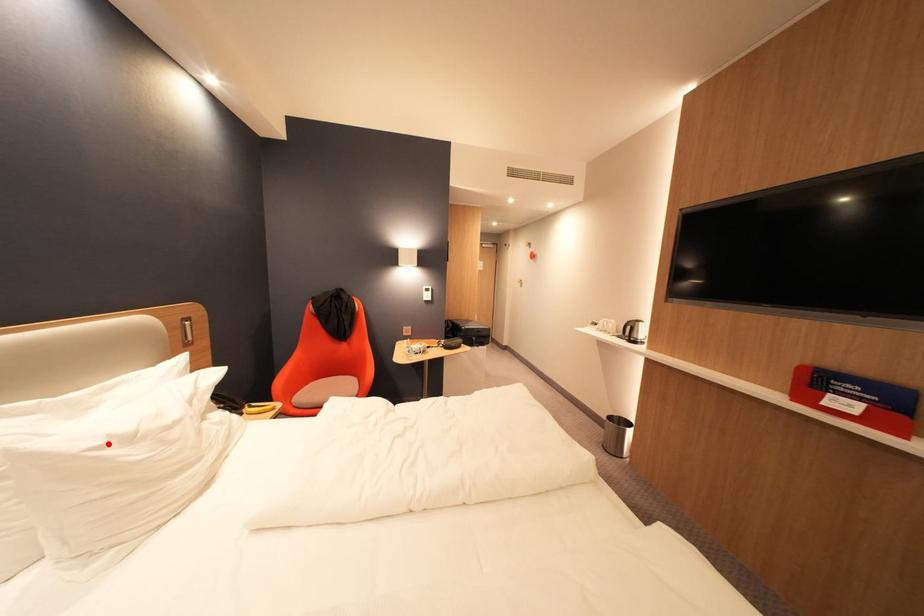
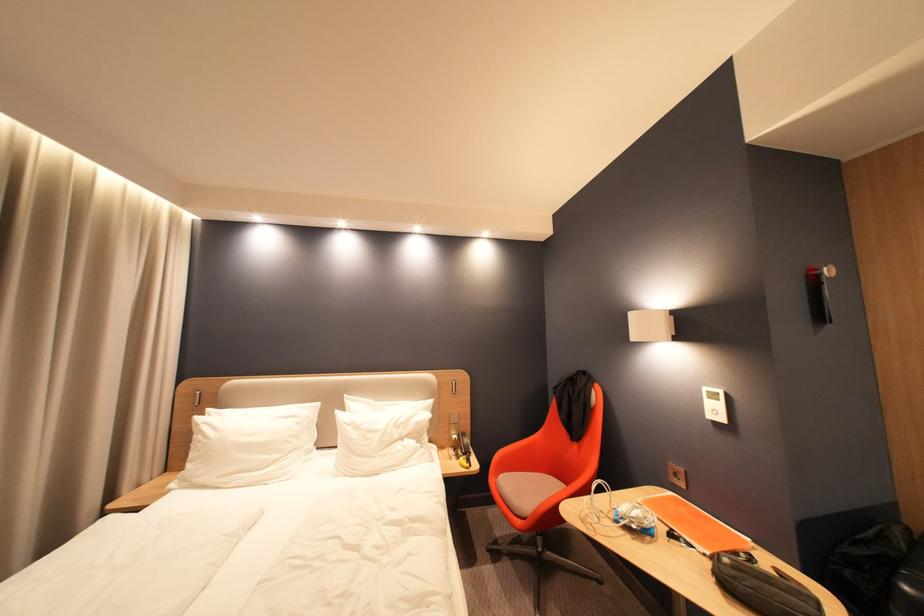
Question: I am providing you with two images of the same scene from different viewpoints. In image1, a red point is highlighted. Considering the same 3D point in image2, which of the following is correct?

Choices:
 (A) It is closer
 (B) It is farther

Answer: (B)